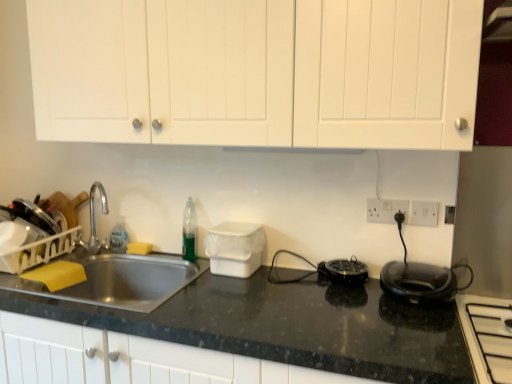
Identify the location of vacant space in front of black glossy electric kettle at right. (417, 329).